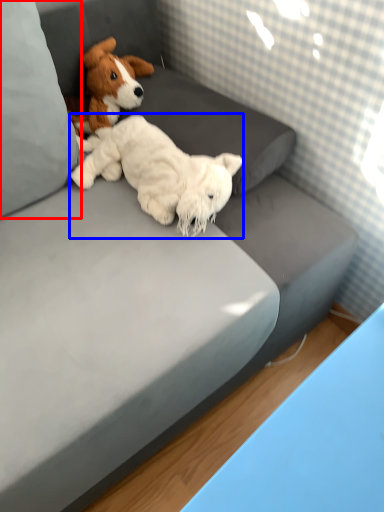
Question: Which point is closer to the camera, pillow (highlighted by a red box) or dog (highlighted by a blue box)?

Choices:
 (A) pillow
 (B) dog

Answer: (A)